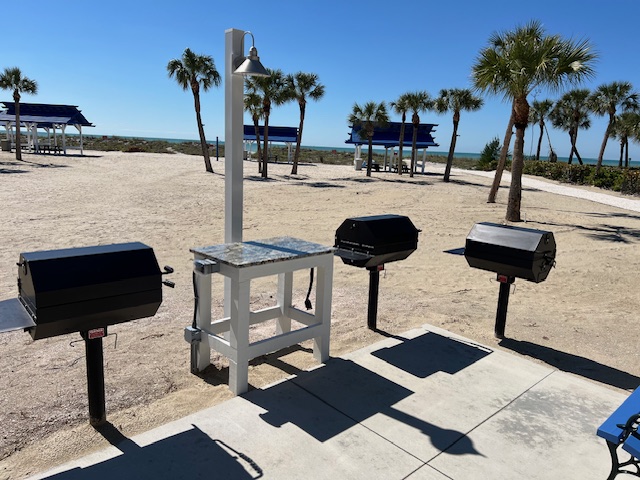
This screenshot has width=640, height=480. I want to click on table, so click(x=275, y=252).